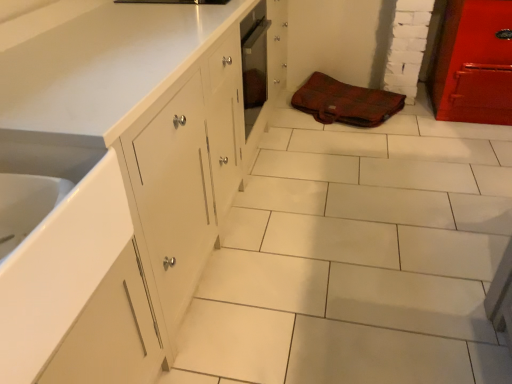
Question: Is white glossy sink at lower left wider or thinner than brown fabric bag at center?

Choices:
 (A) wide
 (B) thin

Answer: (B)

Question: From the image's perspective, is white glossy sink at lower left above or below brown fabric bag at center?

Choices:
 (A) above
 (B) below

Answer: (B)

Question: Considering their positions, is white glossy sink at lower left located in front of or behind brown fabric bag at center?

Choices:
 (A) front
 (B) behind

Answer: (A)

Question: Looking at the image, does brown fabric bag at center seem bigger or smaller compared to white glossy sink at lower left?

Choices:
 (A) big
 (B) small

Answer: (B)

Question: Considering the relative positions of brown fabric bag at center and white glossy sink at lower left in the image provided, is brown fabric bag at center to the left or to the right of white glossy sink at lower left?

Choices:
 (A) right
 (B) left

Answer: (A)

Question: Which is correct: brown fabric bag at center is inside white glossy sink at lower left, or outside of it?

Choices:
 (A) inside
 (B) outside

Answer: (B)

Question: Is point (384, 102) closer or farther from the camera than point (47, 324)?

Choices:
 (A) closer
 (B) farther

Answer: (B)